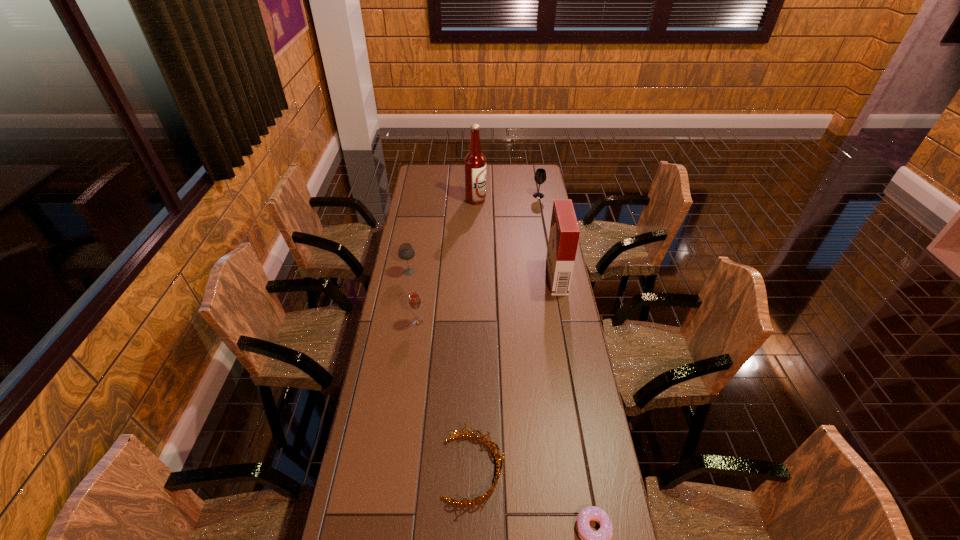
The height and width of the screenshot is (540, 960). I want to click on object that stands as the fourth closest to the tallest object, so click(x=414, y=300).

Locate which object ranks in proximity to the doughnut. Please provide its 2D coordinates. Your answer should be formatted as a tuple, i.e. [(x, y)], where the tuple contains the x and y coordinates of a point satisfying the conditions above.

[(497, 455)]

At what (x,y) coordinates should I click in order to perform the action: click on wineglass that is the closest to the leftmost wineglass. Please return your answer as a coordinate pair (x, y). Image resolution: width=960 pixels, height=540 pixels. Looking at the image, I should click on coord(414,300).

Locate which wineglass ranks third in proximity to the alcohol. Please provide its 2D coordinates. Your answer should be formatted as a tuple, i.e. [(x, y)], where the tuple contains the x and y coordinates of a point satisfying the conditions above.

[(414, 300)]

Identify the location of vacant space that satisfies the following two spatial constraints: 1. on the front side of the rightmost wineglass; 2. on the label side of the tallest object. The image size is (960, 540). (540, 200).